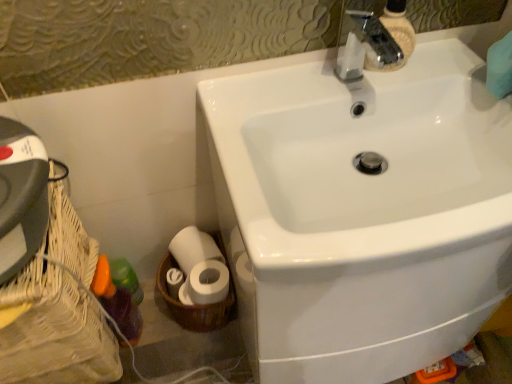
What is the approximate height of white glossy sink at upper right?

white glossy sink at upper right is 31.12 inches tall.

Where is `translucent plastic bottle at lower left`? This screenshot has width=512, height=384. translucent plastic bottle at lower left is located at coordinates (126, 279).

Describe the element at coordinates (126, 279) in the screenshot. The height and width of the screenshot is (384, 512). I see `translucent plastic bottle at lower left` at that location.

From the picture: Measure the distance between woven wood basket at lower left, which is the second basket container from right to left, and camera.

A distance of 24.43 inches exists between woven wood basket at lower left, which is the second basket container from right to left, and camera.

Find the location of a particular element. The height and width of the screenshot is (384, 512). white glossy sink at upper right is located at coordinates (362, 213).

How much distance is there between white glossy sink at upper right and translucent plastic bottle at lower left?

A distance of 56.10 centimeters exists between white glossy sink at upper right and translucent plastic bottle at lower left.

Does white glossy sink at upper right come in front of translucent plastic bottle at lower left?

Yes, white glossy sink at upper right is closer to the viewer.

Is white glossy sink at upper right taller than translucent plastic bottle at lower left?

Yes, white glossy sink at upper right is taller than translucent plastic bottle at lower left.

Does point (266, 115) come in front of point (129, 341)?

Yes, point (266, 115) is in front of point (129, 341).

From the image's perspective, does white glossy sink at upper right appear higher than woven wood basket at lower left, the first basket container when ordered from left to right?

Yes, from the image's perspective, white glossy sink at upper right is above woven wood basket at lower left, the first basket container when ordered from left to right.

Does point (384, 254) come farther from viewer compared to point (51, 347)?

No, it is in front of (51, 347).

From a real-world perspective, is white glossy sink at upper right over woven wood basket at lower left, which is the second basket container from right to left?

Actually, white glossy sink at upper right is physically below woven wood basket at lower left, which is the second basket container from right to left, in the real world.

Considering their positions, is white glossy sink at upper right located in front of or behind woven wood basket at lower left, the first basket container when ordered from left to right?

Visually, white glossy sink at upper right is located in front of woven wood basket at lower left, the first basket container when ordered from left to right.

Is translucent plastic bottle at lower left surrounded by white woven basket at lower left, which appears as the second basket container when viewed from the left?

No, translucent plastic bottle at lower left is not a part of white woven basket at lower left, which appears as the second basket container when viewed from the left.

In the scene shown: Which object is positioned more to the left, white woven basket at lower left, which ranks as the 1th basket container in right-to-left order, or translucent plastic bottle at lower left?

translucent plastic bottle at lower left is more to the left.

From the picture: Looking at the image, does white woven basket at lower left, which ranks as the 1th basket container in right-to-left order, seem bigger or smaller compared to translucent plastic bottle at lower left?

In the image, white woven basket at lower left, which ranks as the 1th basket container in right-to-left order, appears to be larger than translucent plastic bottle at lower left.

Based on the photo, is translucent plastic bottle at lower left positioned with its back to woven wood basket at lower left, which is the second basket container from right to left?

Absolutely, translucent plastic bottle at lower left is directed away from woven wood basket at lower left, which is the second basket container from right to left.

From the picture: How different are the orientations of translucent plastic bottle at lower left and woven wood basket at lower left, which is the second basket container from right to left, in degrees?

89.1 degrees.

Is translucent plastic bottle at lower left outside of woven wood basket at lower left, which is the second basket container from right to left?

Actually, translucent plastic bottle at lower left is within woven wood basket at lower left, which is the second basket container from right to left.

Between white woven basket at lower left, which ranks as the 1th basket container in right-to-left order, and translucent plastic bottle at lower left, which one has larger size?

With larger size is white woven basket at lower left, which ranks as the 1th basket container in right-to-left order.

Can you confirm if white woven basket at lower left, which appears as the second basket container when viewed from the left, is thinner than translucent plastic bottle at lower left?

In fact, white woven basket at lower left, which appears as the second basket container when viewed from the left, might be wider than translucent plastic bottle at lower left.

Considering the sizes of white woven basket at lower left, which appears as the second basket container when viewed from the left, and translucent plastic bottle at lower left in the image, is white woven basket at lower left, which appears as the second basket container when viewed from the left, taller or shorter than translucent plastic bottle at lower left?

Considering their sizes, white woven basket at lower left, which appears as the second basket container when viewed from the left, has more height than translucent plastic bottle at lower left.

From the image's perspective, is woven wood basket at lower left, which is the second basket container from right to left, over white woven basket at lower left, which appears as the second basket container when viewed from the left?

Incorrect, from the image's perspective, woven wood basket at lower left, which is the second basket container from right to left, is lower than white woven basket at lower left, which appears as the second basket container when viewed from the left.

From a real-world perspective, is woven wood basket at lower left, the first basket container when ordered from left to right, positioned above or below white woven basket at lower left, which ranks as the 1th basket container in right-to-left order?

woven wood basket at lower left, the first basket container when ordered from left to right, is above white woven basket at lower left, which ranks as the 1th basket container in right-to-left order.

Is woven wood basket at lower left, the first basket container when ordered from left to right, further to the viewer compared to white woven basket at lower left, which ranks as the 1th basket container in right-to-left order?

No, woven wood basket at lower left, the first basket container when ordered from left to right, is closer to the viewer.

Considering the relative positions of woven wood basket at lower left, which is the second basket container from right to left, and white woven basket at lower left, which appears as the second basket container when viewed from the left, in the image provided, is woven wood basket at lower left, which is the second basket container from right to left, to the right of white woven basket at lower left, which appears as the second basket container when viewed from the left, from the viewer's perspective?

In fact, woven wood basket at lower left, which is the second basket container from right to left, is to the left of white woven basket at lower left, which appears as the second basket container when viewed from the left.

Is white woven basket at lower left, which ranks as the 1th basket container in right-to-left order, taller than white glossy sink at upper right?

Incorrect, the height of white woven basket at lower left, which ranks as the 1th basket container in right-to-left order, is not larger of that of white glossy sink at upper right.

Considering their positions, is white woven basket at lower left, which ranks as the 1th basket container in right-to-left order, located in front of or behind white glossy sink at upper right?

Visually, white woven basket at lower left, which ranks as the 1th basket container in right-to-left order, is located behind white glossy sink at upper right.

From a real-world perspective, which object stands above the other?

white glossy sink at upper right.

Which of these two, white woven basket at lower left, which ranks as the 1th basket container in right-to-left order, or white glossy sink at upper right, is wider?

white glossy sink at upper right.

Locate an element on the screen. This screenshot has width=512, height=384. bottle on the left of white glossy sink at upper right is located at coordinates (117, 303).

From the image's perspective, starting from the white glossy sink at upper right, which basket container is the 2nd one below? Please provide its 2D coordinates.

[(57, 310)]

Which object lies further to the anchor point woven wood basket at lower left, the first basket container when ordered from left to right, translucent plastic bottle at lower left or white woven basket at lower left, which appears as the second basket container when viewed from the left?

white woven basket at lower left, which appears as the second basket container when viewed from the left, lies further to woven wood basket at lower left, the first basket container when ordered from left to right, than the other object.

Based on their spatial positions, is white glossy sink at upper right or translucent plastic bottle at lower left closer to woven wood basket at lower left, the first basket container when ordered from left to right?

translucent plastic bottle at lower left.

Looking at the image, which one is located further to white glossy sink at upper right, woven wood basket at lower left, the first basket container when ordered from left to right, or translucent plastic bottle at lower left?

translucent plastic bottle at lower left lies further to white glossy sink at upper right than the other object.

Based on their spatial positions, is translucent plastic bottle at lower left or white woven basket at lower left, which ranks as the 1th basket container in right-to-left order, further from translucent plastic bottle at lower left?

The object further to translucent plastic bottle at lower left is white woven basket at lower left, which ranks as the 1th basket container in right-to-left order.

Based on their spatial positions, is translucent plastic bottle at lower left or white glossy sink at upper right further from woven wood basket at lower left, which is the second basket container from right to left?

Based on the image, white glossy sink at upper right appears to be further to woven wood basket at lower left, which is the second basket container from right to left.

Considering their positions, is translucent plastic bottle at lower left positioned closer to translucent plastic bottle at lower left than white glossy sink at upper right?

The object closer to translucent plastic bottle at lower left is translucent plastic bottle at lower left.

From the image, which object appears to be nearer to white glossy sink at upper right, translucent plastic bottle at lower left or woven wood basket at lower left, the first basket container when ordered from left to right?

The object closer to white glossy sink at upper right is woven wood basket at lower left, the first basket container when ordered from left to right.

Based on their spatial positions, is translucent plastic bottle at lower left or woven wood basket at lower left, which is the second basket container from right to left, further from white glossy sink at upper right?

translucent plastic bottle at lower left.

Where is `bottle between woven wood basket at lower left, which is the second basket container from right to left, and white glossy sink at upper right`? The height and width of the screenshot is (384, 512). bottle between woven wood basket at lower left, which is the second basket container from right to left, and white glossy sink at upper right is located at coordinates (117, 303).

The width and height of the screenshot is (512, 384). Find the location of `basket container between translucent plastic bottle at lower left and white glossy sink at upper right`. basket container between translucent plastic bottle at lower left and white glossy sink at upper right is located at coordinates (195, 305).

I want to click on bottle between woven wood basket at lower left, the first basket container when ordered from left to right, and white woven basket at lower left, which ranks as the 1th basket container in right-to-left order, from front to back, so click(x=117, y=303).

This screenshot has height=384, width=512. I want to click on bottle between translucent plastic bottle at lower left and white woven basket at lower left, which ranks as the 1th basket container in right-to-left order, in the horizontal direction, so click(117, 303).